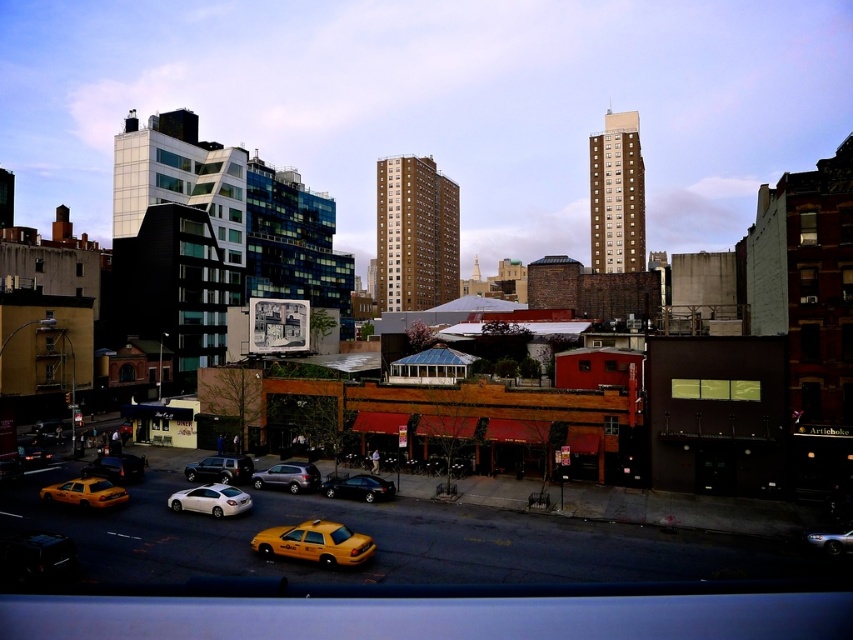
Between point (248, 464) and point (820, 536), which one is positioned in front?

Point (820, 536) is more forward.

Is matte black suv at center positioned at the back of metallic silver car at lower right?

Yes, matte black suv at center is further from the viewer.

Between point (247, 460) and point (850, 532), which one is positioned behind?

The point (247, 460) is behind.

Where is `matte black suv at center`? matte black suv at center is located at coordinates (219, 468).

Is white matte sedan at center smaller than matte black suv at center?

Correct, white matte sedan at center occupies less space than matte black suv at center.

Identify the location of white matte sedan at center. (210, 500).

Does yellow matte taxi at center appear on the left side of satin silver suv at center?

In fact, yellow matte taxi at center is to the right of satin silver suv at center.

Describe the element at coordinates (314, 544) in the screenshot. The width and height of the screenshot is (853, 640). I see `yellow matte taxi at center` at that location.

Find the location of a particular element. This screenshot has height=640, width=853. yellow matte taxi at center is located at coordinates (314, 544).